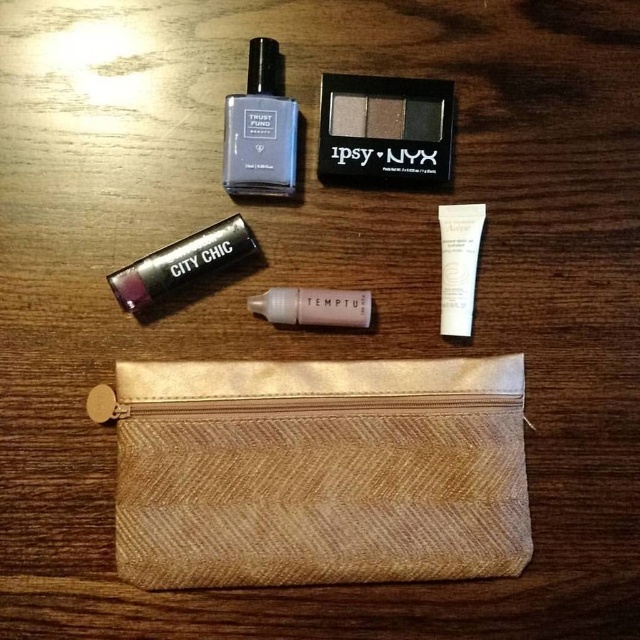
Question: Which point appears closest to the camera in this image?

Choices:
 (A) (401, 512)
 (B) (317, 298)
 (C) (218, 268)

Answer: (A)

Question: Which of the following is the farthest from the observer?

Choices:
 (A) matte black lipstick at upper left
 (B) satin black nail polish at upper center
 (C) satin pink liquid at center

Answer: (C)

Question: Is satin black nail polish at upper center bigger than satin pink liquid at center?

Choices:
 (A) no
 (B) yes

Answer: (B)

Question: Which point is closer to the camera?

Choices:
 (A) matte eyeshadow palette at upper center
 (B) gold textured pouch at center

Answer: (B)

Question: Does matte black lipstick at upper left appear under white matte tube at upper right?

Choices:
 (A) yes
 (B) no

Answer: (B)

Question: Can you confirm if gold textured pouch at center is positioned below matte black lipstick at upper left?

Choices:
 (A) no
 (B) yes

Answer: (B)